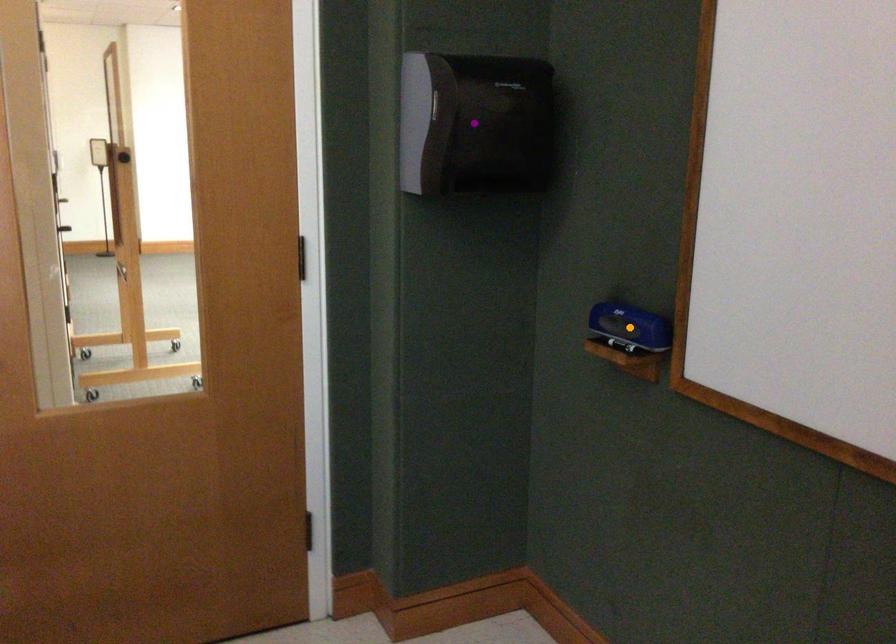
Order these from farthest to nearest:
- orange point
- purple point
- red point

purple point < orange point < red point